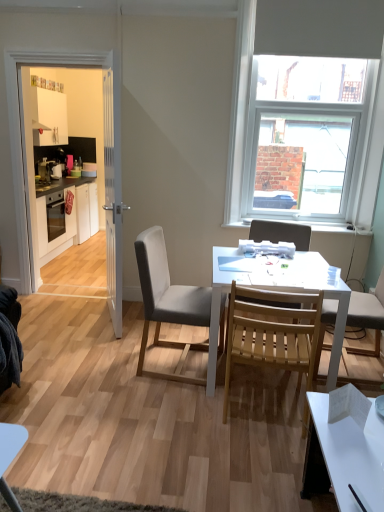
The width and height of the screenshot is (384, 512). I want to click on free spot above white glossy door at left (from a real-world perspective), so click(x=56, y=42).